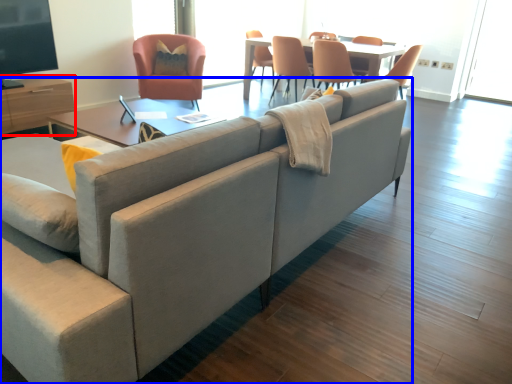
Question: Which of the following is the farthest to the observer, entertainment center (highlighted by a red box) or studio couch (highlighted by a blue box)?

Choices:
 (A) entertainment center
 (B) studio couch

Answer: (A)